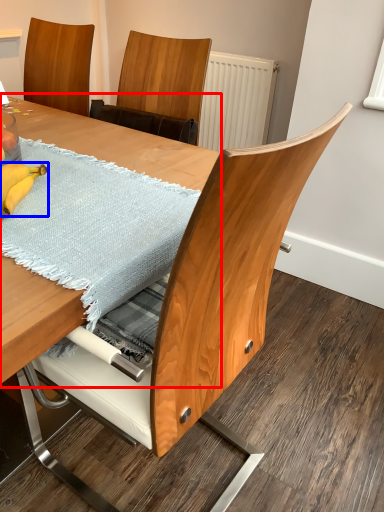
Question: Which of the following is the farthest to the observer, table (highlighted by a red box) or banana (highlighted by a blue box)?

Choices:
 (A) table
 (B) banana

Answer: (B)